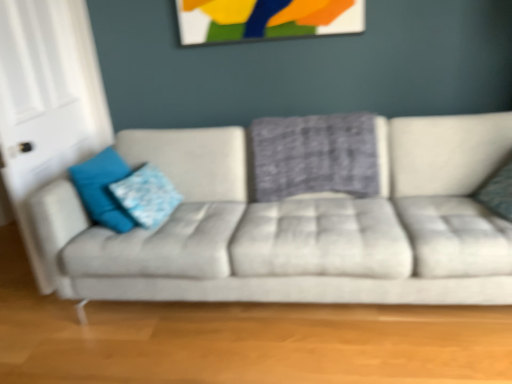
Question: Is point (290, 175) positioned closer to the camera than point (204, 1)?

Choices:
 (A) closer
 (B) farther

Answer: (A)

Question: From the image's perspective, is plaid fabric pillow at center, marked as the second pillow in a right-to-left arrangement, positioned above or below painted wood picture frame at upper center?

Choices:
 (A) below
 (B) above

Answer: (A)

Question: Based on their relative distances, which object is farther from the textured gray couch at center?

Choices:
 (A) painted wood picture frame at upper center
 (B) white glossy door at left
 (C) teal fabric pillow at right, which is the 4th pillow in left-to-right order
 (D) blue fabric pillow at left, which ranks as the third pillow in right-to-left order
 (E) plaid fabric pillow at center, which is the third pillow in left-to-right order

Answer: (A)

Question: Estimate the real-world distances between objects in this image. Which object is closer to the textured gray couch at center?

Choices:
 (A) teal fabric pillow at right, marked as the 1th pillow in a right-to-left arrangement
 (B) blue fabric pillow at left, the 1th pillow viewed from the left
 (C) painted wood picture frame at upper center
 (D) plaid fabric pillow at center, which is the third pillow in left-to-right order
 (E) blue fabric pillow at left, acting as the 2th pillow starting from the left

Answer: (D)